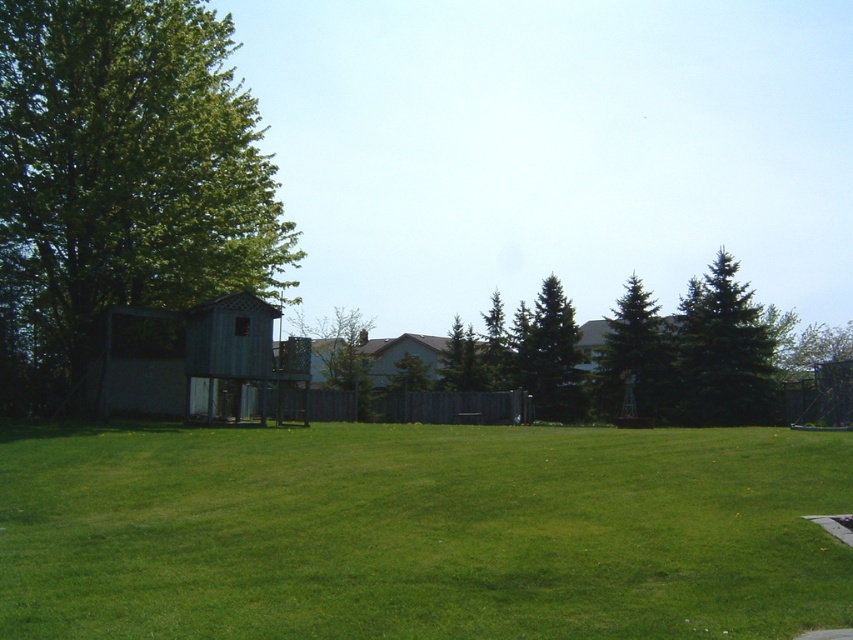
You are standing at the camera position looking at the backyard. There is a point at coordinates point (297, 481). Can you reach that point by walking straight ahead from your current position without changing direction?

The point at coordinates point (297, 481) is 46.11 feet away from the camera position. Since there are no obstacles mentioned in the scene description blocking the path, you can walk straight ahead to reach it.

You are planning to install a new garden light in the backyard. The light requires a clear line of sight to the shed for its motion sensor to work properly. Given the positions of the green leafy tree at left and the green textured pine tree at center, will the shed be visible from the light if placed between these two trees?

The green leafy tree at left is in front of the green textured pine tree at center, meaning the shed behind the green leafy tree at left would be obscured from view between them. Therefore, placing the light between these trees would block the line of sight to the shed.

You are planning to install a new swing set in your backyard and need to ensure there is enough vertical space between the green leafy tree at left and the green textured pine tree at center. Which tree has a greater height that might interfere with the swing set installation?

The green leafy tree at left is taller than the green textured pine tree at center, so it has a greater height and might interfere with the swing set installation.